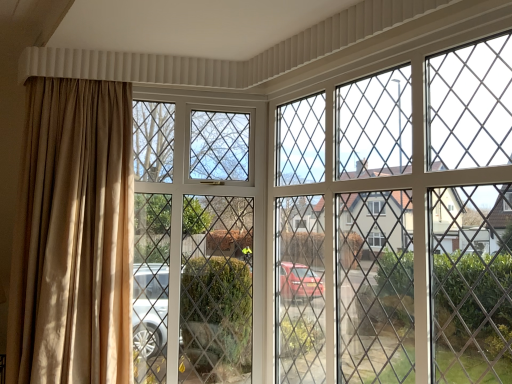
In order to face clear glass screen door at upper center, which is the first screen door from right to left, should I rotate leftwards or rightwards?

Turn right by 14.167 degrees to look at clear glass screen door at upper center, which is the first screen door from right to left.

Locate an element on the screen. The image size is (512, 384). clear glass screen door at center, the 1th screen door when ordered from left to right is located at coordinates (202, 229).

How much distance is there between clear glass screen door at center, the 2th screen door viewed from the right, and beige fabric curtain at left?

They are 17.31 inches apart.

Can you confirm if clear glass screen door at center, the 1th screen door when ordered from left to right, is thinner than beige fabric curtain at left?

Indeed, clear glass screen door at center, the 1th screen door when ordered from left to right, has a lesser width compared to beige fabric curtain at left.

Does clear glass screen door at center, the 1th screen door when ordered from left to right, have a lesser height compared to beige fabric curtain at left?

No.

Considering the positions of point (152, 128) and point (84, 302), is point (152, 128) closer or farther from the camera than point (84, 302)?

Point (152, 128) is farther from the camera than point (84, 302).

From the picture: In terms of width, does clear glass screen door at upper center, which is the first screen door from right to left, look wider or thinner when compared to beige fabric curtain at left?

In the image, clear glass screen door at upper center, which is the first screen door from right to left, appears to be more narrow than beige fabric curtain at left.

From the image's perspective, between clear glass screen door at upper center, which is the first screen door from right to left, and beige fabric curtain at left, who is located below?

clear glass screen door at upper center, which is the first screen door from right to left, is shown below in the image.

From a real-world perspective, count 1st screen doors downward from the beige fabric curtain at left and point to it. Please provide its 2D coordinates.

[(347, 237)]

Locate an element on the screen. curtain that appears above the clear glass screen door at upper center, which is the first screen door from right to left (from a real-world perspective) is located at coordinates (73, 236).

Which of these two, beige fabric curtain at left or clear glass screen door at upper center, which is the first screen door from right to left, stands shorter?

With less height is beige fabric curtain at left.

Does point (79, 126) appear closer or farther from the camera than point (301, 263)?

Point (79, 126) appears to be closer to the viewer than point (301, 263).

This screenshot has height=384, width=512. I want to click on screen door that is on the right side of clear glass screen door at center, the 2th screen door viewed from the right, so click(347, 237).

Between clear glass screen door at upper center, which is the first screen door from right to left, and clear glass screen door at center, the 2th screen door viewed from the right, which one has larger width?

clear glass screen door at center, the 2th screen door viewed from the right, is wider.

Is clear glass screen door at upper center, which is the first screen door from right to left, further to the viewer compared to clear glass screen door at center, the 1th screen door when ordered from left to right?

No, clear glass screen door at upper center, which is the first screen door from right to left, is closer to the camera.

Is point (292, 293) closer to viewer compared to point (238, 291)?

Yes, point (292, 293) is in front of point (238, 291).

Is beige fabric curtain at left facing towards clear glass screen door at center, the 2th screen door viewed from the right?

No, beige fabric curtain at left is not oriented towards clear glass screen door at center, the 2th screen door viewed from the right.

In terms of height, does beige fabric curtain at left look taller or shorter compared to clear glass screen door at center, the 1th screen door when ordered from left to right?

beige fabric curtain at left is shorter than clear glass screen door at center, the 1th screen door when ordered from left to right.

Considering the positions of objects clear glass screen door at center, the 1th screen door when ordered from left to right, and clear glass screen door at upper center, which is the 2th screen door in left-to-right order, in the image provided, who is behind, clear glass screen door at center, the 1th screen door when ordered from left to right, or clear glass screen door at upper center, which is the 2th screen door in left-to-right order,?

clear glass screen door at center, the 1th screen door when ordered from left to right, is more distant.

What's the angular difference between clear glass screen door at center, the 2th screen door viewed from the right, and clear glass screen door at upper center, which is the 2th screen door in left-to-right order,'s facing directions?

The angle between the facing direction of clear glass screen door at center, the 2th screen door viewed from the right, and the facing direction of clear glass screen door at upper center, which is the 2th screen door in left-to-right order, is 58.9 degrees.

Looking at this image, from the image's perspective, is clear glass screen door at center, the 2th screen door viewed from the right, below clear glass screen door at upper center, which is the 2th screen door in left-to-right order?

Yes, from the image's perspective, clear glass screen door at center, the 2th screen door viewed from the right, is beneath clear glass screen door at upper center, which is the 2th screen door in left-to-right order.

Between clear glass screen door at center, the 2th screen door viewed from the right, and clear glass screen door at upper center, which is the first screen door from right to left, which one has smaller width?

Thinner between the two is clear glass screen door at upper center, which is the first screen door from right to left.

Find the location of a particular element. The width and height of the screenshot is (512, 384). curtain that is in front of the clear glass screen door at center, the 1th screen door when ordered from left to right is located at coordinates [73, 236].

Identify the location of curtain lying behind the clear glass screen door at upper center, which is the first screen door from right to left. The width and height of the screenshot is (512, 384). (73, 236).

Considering their positions, is clear glass screen door at center, the 2th screen door viewed from the right, positioned further to clear glass screen door at upper center, which is the first screen door from right to left, than beige fabric curtain at left?

beige fabric curtain at left lies further to clear glass screen door at upper center, which is the first screen door from right to left, than the other object.

Looking at the image, which one is located closer to clear glass screen door at center, the 1th screen door when ordered from left to right, beige fabric curtain at left or clear glass screen door at upper center, which is the first screen door from right to left?

beige fabric curtain at left lies closer to clear glass screen door at center, the 1th screen door when ordered from left to right, than the other object.

Looking at the image, which one is located closer to beige fabric curtain at left, clear glass screen door at center, the 1th screen door when ordered from left to right, or clear glass screen door at upper center, which is the 2th screen door in left-to-right order?

Based on the image, clear glass screen door at center, the 1th screen door when ordered from left to right, appears to be nearer to beige fabric curtain at left.

Looking at the image, which one is located further to beige fabric curtain at left, clear glass screen door at upper center, which is the 2th screen door in left-to-right order, or clear glass screen door at center, the 1th screen door when ordered from left to right?

clear glass screen door at upper center, which is the 2th screen door in left-to-right order, is positioned further to the anchor beige fabric curtain at left.

Looking at the image, which one is located further to clear glass screen door at center, the 1th screen door when ordered from left to right, clear glass screen door at upper center, which is the first screen door from right to left, or beige fabric curtain at left?

The object further to clear glass screen door at center, the 1th screen door when ordered from left to right, is clear glass screen door at upper center, which is the first screen door from right to left.

Based on their spatial positions, is beige fabric curtain at left or clear glass screen door at center, the 2th screen door viewed from the right, closer to clear glass screen door at upper center, which is the 2th screen door in left-to-right order?

The object closer to clear glass screen door at upper center, which is the 2th screen door in left-to-right order, is clear glass screen door at center, the 2th screen door viewed from the right.

I want to click on screen door located between beige fabric curtain at left and clear glass screen door at upper center, which is the first screen door from right to left, in the left-right direction, so click(x=202, y=229).